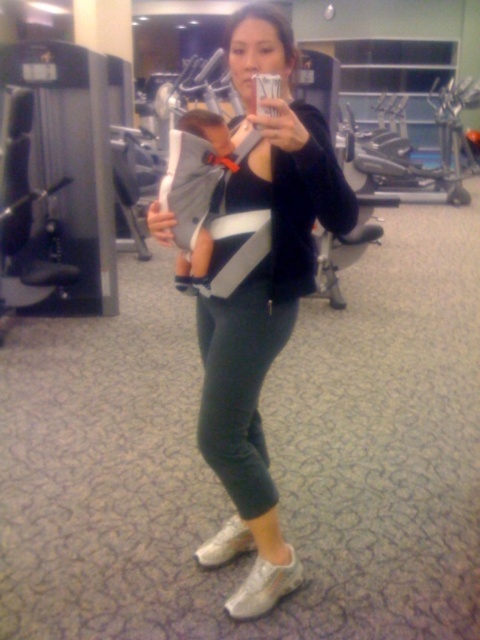
Is black matte baby carrier at center positioned at the back of dark green leggings at center?

No, it is not.

Which is more to the right, black matte baby carrier at center or dark green leggings at center?

Positioned to the right is black matte baby carrier at center.

Is point (287, 580) positioned after point (252, 426)?

That is False.

The image size is (480, 640). I want to click on black matte baby carrier at center, so (263, 300).